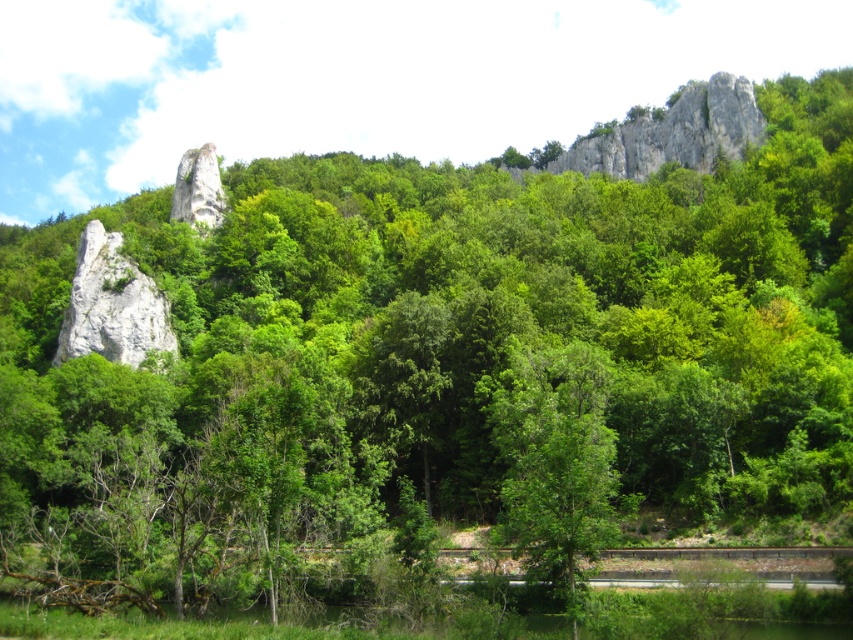
Consider the image. Does white rock formation at upper center appear under white rough rock at left?

No.

Can you confirm if white rock formation at upper center is shorter than white rough rock at left?

Incorrect, white rock formation at upper center's height does not fall short of white rough rock at left's.

Between point (633, 179) and point (86, 298), which one is positioned behind?

Point (633, 179)

The image size is (853, 640). I want to click on white rock formation at upper center, so click(x=675, y=132).

Is white rock formation at upper center shorter than white rough rock at center?

Correct, white rock formation at upper center is not as tall as white rough rock at center.

Who is lower down, white rock formation at upper center or white rough rock at center?

white rough rock at center is below.

The width and height of the screenshot is (853, 640). I want to click on white rock formation at upper center, so click(x=675, y=132).

Does white rough rock at left have a greater width compared to white rough rock at center?

Yes, white rough rock at left is wider than white rough rock at center.

Can you confirm if white rough rock at left is smaller than white rough rock at center?

Indeed, white rough rock at left has a smaller size compared to white rough rock at center.

Which is in front, point (105, 342) or point (198, 180)?

Point (105, 342) is more forward.

Image resolution: width=853 pixels, height=640 pixels. Identify the location of white rough rock at left. (112, 305).